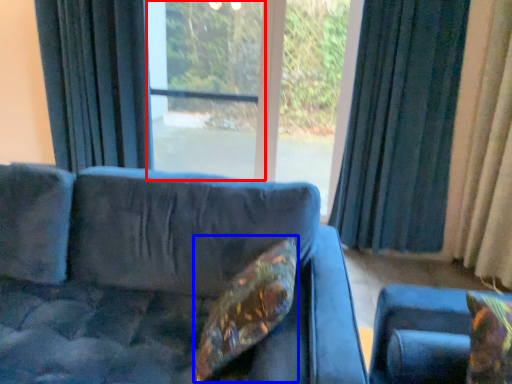
Question: Which of the following is the closest to the observer, screen door (highlighted by a red box) or pillow (highlighted by a blue box)?

Choices:
 (A) screen door
 (B) pillow

Answer: (B)